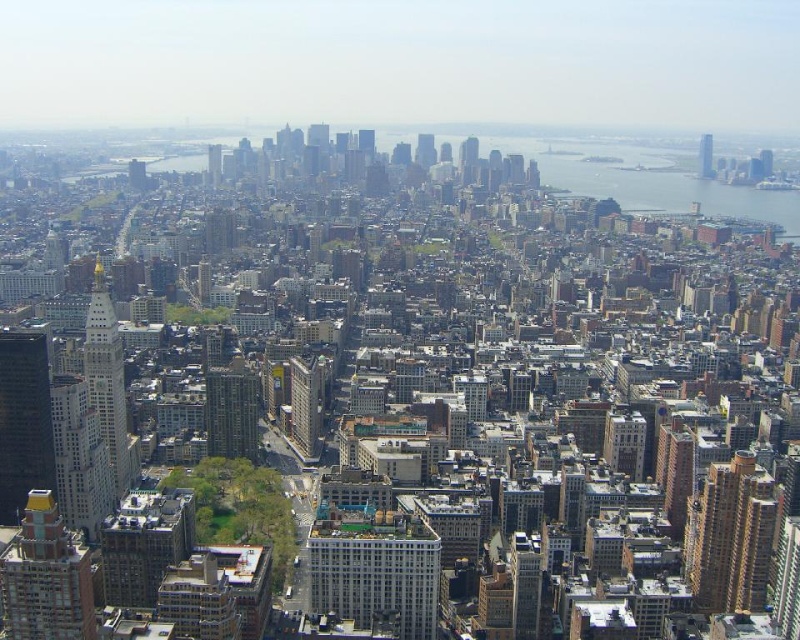
Can you confirm if white glass skyscraper at left is positioned below white marble tower at left?

Yes.

The width and height of the screenshot is (800, 640). I want to click on white glass skyscraper at left, so click(x=80, y=458).

Who is more forward, (16, 540) or (420, 134)?

Point (420, 134)

Does gold-tipped brick building at lower left have a smaller size compared to matte glass skyscraper at center?

Incorrect, gold-tipped brick building at lower left is not smaller in size than matte glass skyscraper at center.

Between point (30, 525) and point (429, 144), which one is positioned behind?

The point (30, 525) is behind.

Locate an element on the screen. This screenshot has height=640, width=800. gold-tipped brick building at lower left is located at coordinates (46, 577).

Is white brick building at center below matte glass skyscraper at upper right?

Correct, white brick building at center is located below matte glass skyscraper at upper right.

Can you confirm if white brick building at center is positioned above matte glass skyscraper at upper right?

Actually, white brick building at center is below matte glass skyscraper at upper right.

At what (x,y) coordinates should I click in order to perform the action: click on white brick building at center. Please return your answer as a coordinate pair (x, y). Looking at the image, I should click on (374, 570).

You are a GUI agent. You are given a task and a screenshot of the screen. Output one action in this format:
    pyautogui.click(x=<x>, y=<y>)
    Task: Click on the white brick building at center
    Image resolution: width=800 pixels, height=640 pixels.
    Given the screenshot: What is the action you would take?
    pyautogui.click(x=374, y=570)